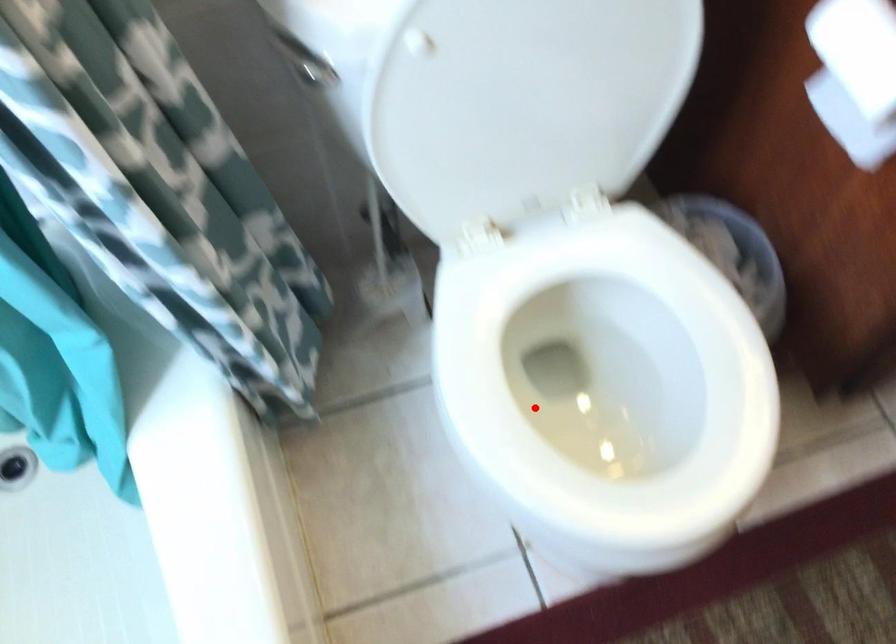
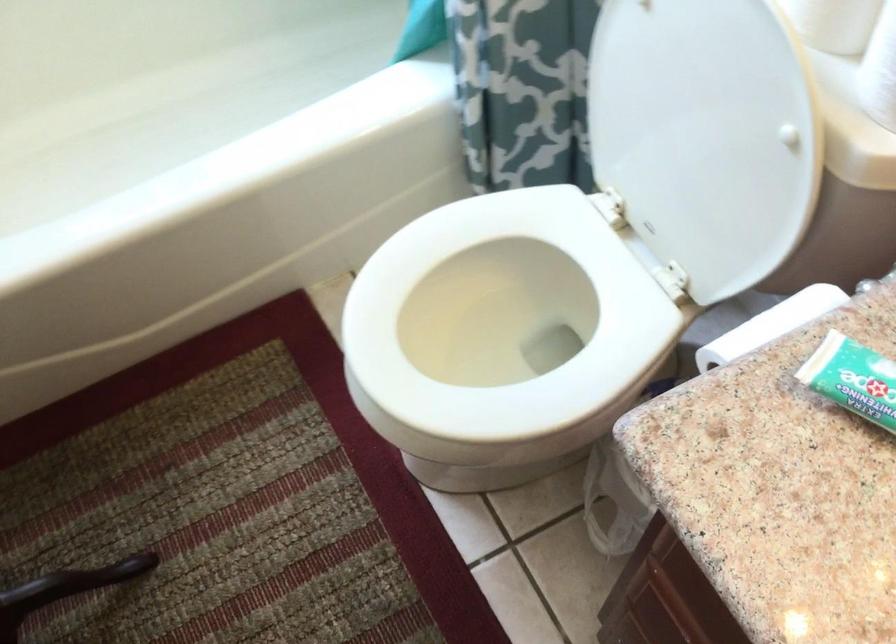
Locate, in the second image, the point that corresponds to the highlighted location in the first image.

(504, 334)